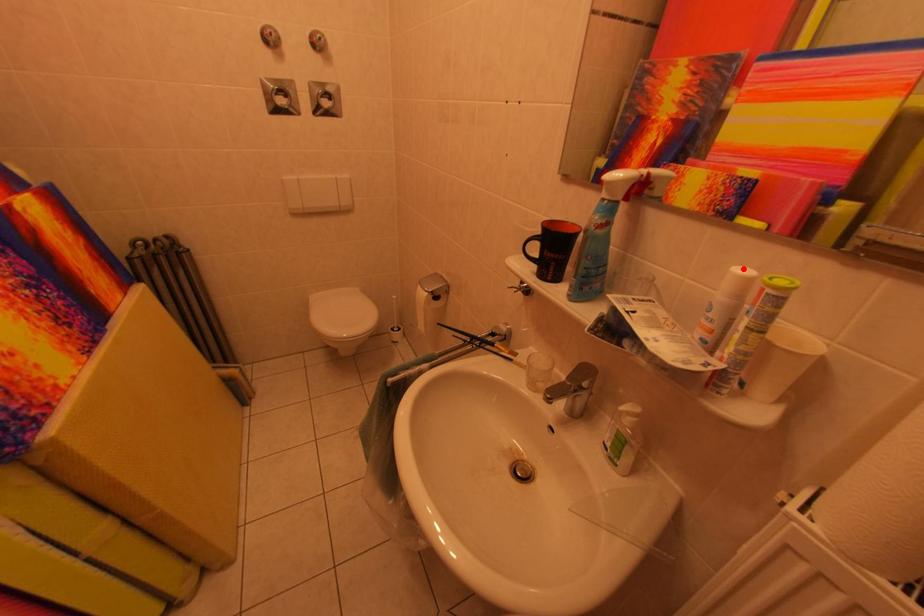
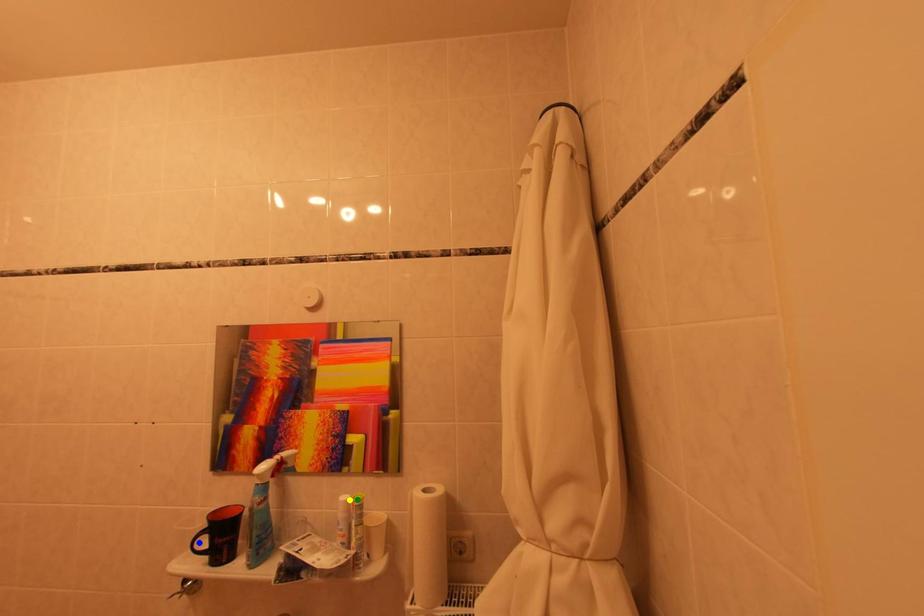
Question: I am providing you with two images of the same scene from different viewpoints. A red point is marked on the first image. You are given multiple points on the second image. Which point in image 2 represents the same 3d spot as the red point in image 1?

Choices:
 (A) green point
 (B) yellow point
 (C) blue point

Answer: (B)